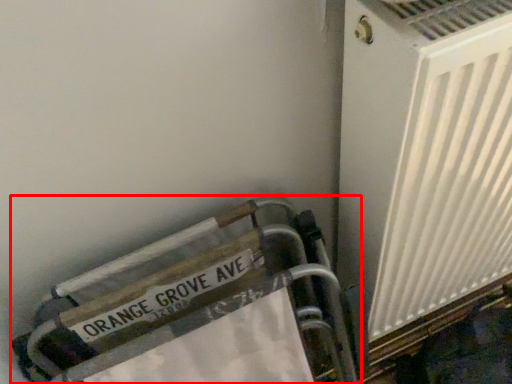
Question: In this image, where is furniture (annotated by the red box) located relative to air conditioning?

Choices:
 (A) right
 (B) left

Answer: (B)